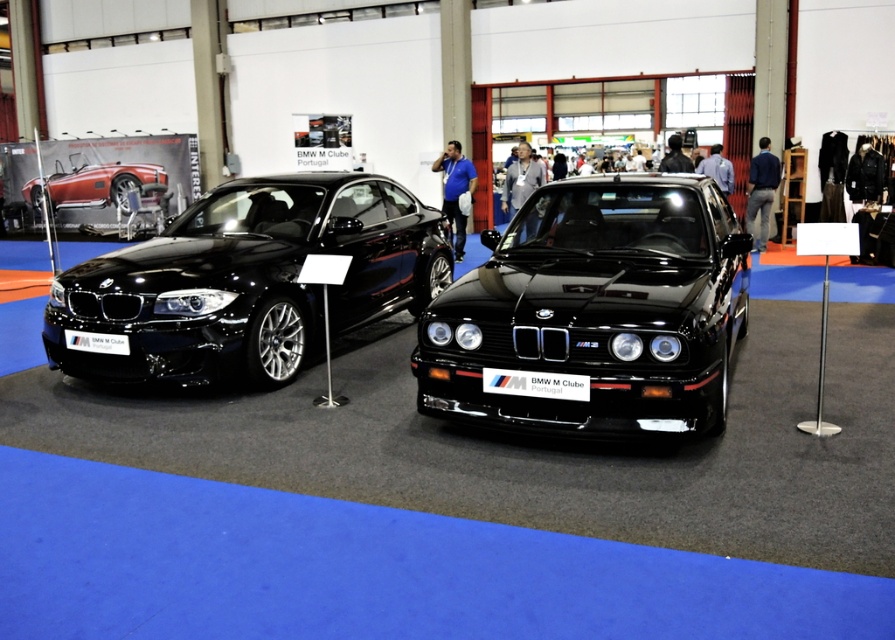
Question: Which of these objects is positioned farthest from the matte black car at left?

Choices:
 (A) glossy black car at center
 (B) black plastic sign at center

Answer: (B)

Question: Based on their relative distances, which object is farther from the glossy black car at center?

Choices:
 (A) white plastic license plate at lower left
 (B) black plastic sign at center
 (C) matte black car at left

Answer: (A)

Question: Is matte black car at left to the left of metallic red car at left from the viewer's perspective?

Choices:
 (A) yes
 (B) no

Answer: (B)

Question: Can you confirm if glossy black car at center is thinner than metallic red car at left?

Choices:
 (A) yes
 (B) no

Answer: (A)

Question: Does glossy black car at center have a smaller size compared to white plastic license plate at lower left?

Choices:
 (A) no
 (B) yes

Answer: (A)

Question: Which object is farther from the camera taking this photo?

Choices:
 (A) white plastic license plate at lower left
 (B) glossy black car at center
 (C) matte black car at left
 (D) black plastic sign at center

Answer: (A)